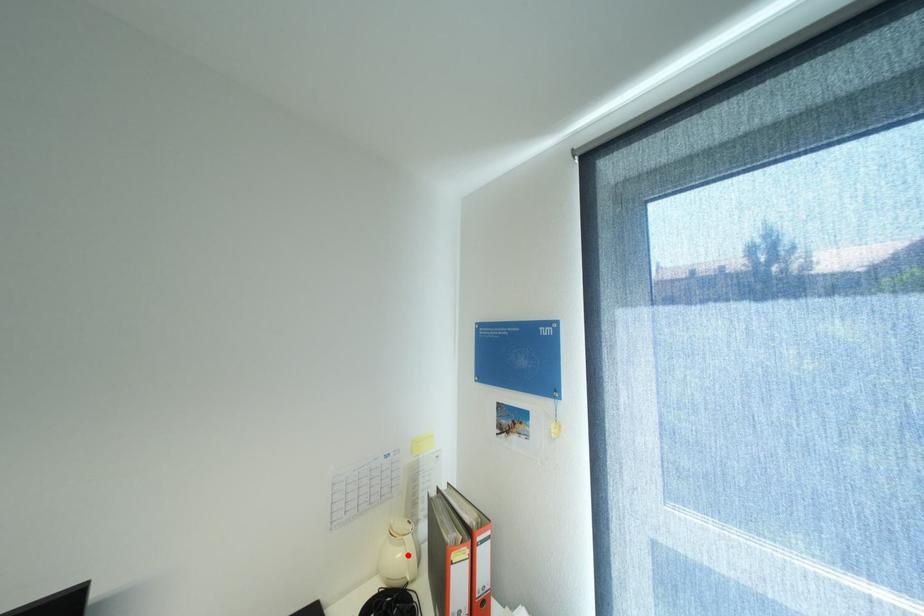
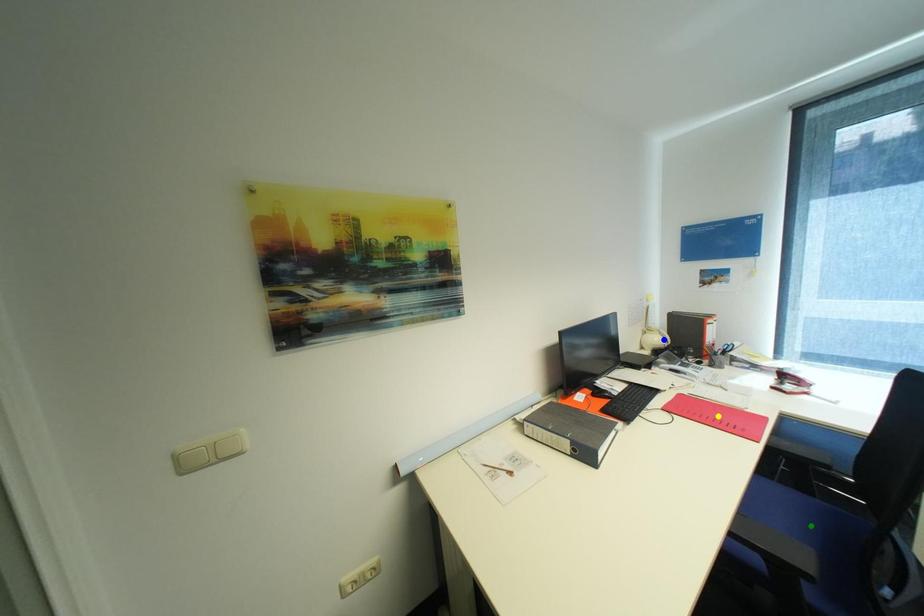
Question: I am providing you with two images of the same scene from different viewpoints. A red point is marked on the first image. You are given multiple points on the second image. Which mark in image 2 goes with the point in image 1?

Choices:
 (A) yellow point
 (B) green point
 (C) blue point

Answer: (C)